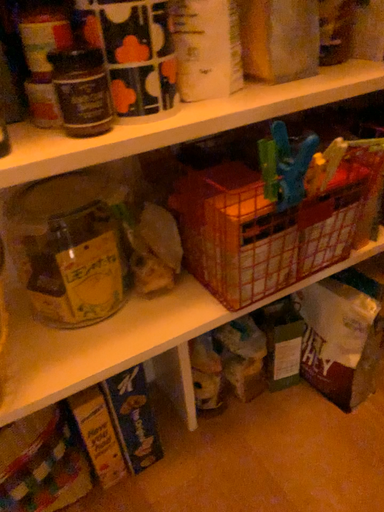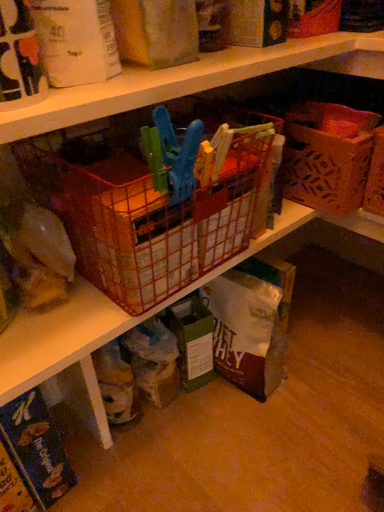
Question: How did the camera likely rotate when shooting the video?

Choices:
 (A) rotated right
 (B) rotated left

Answer: (A)